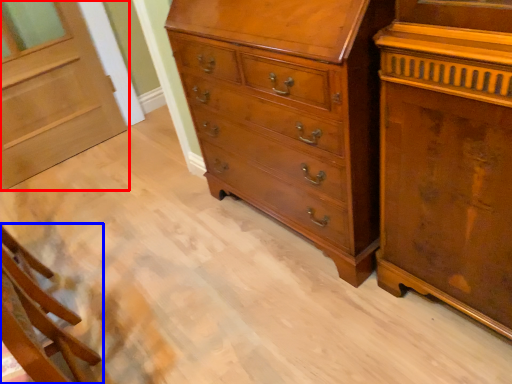
Question: Which point is further to the camera, door (highlighted by a red box) or furniture (highlighted by a blue box)?

Choices:
 (A) door
 (B) furniture

Answer: (A)